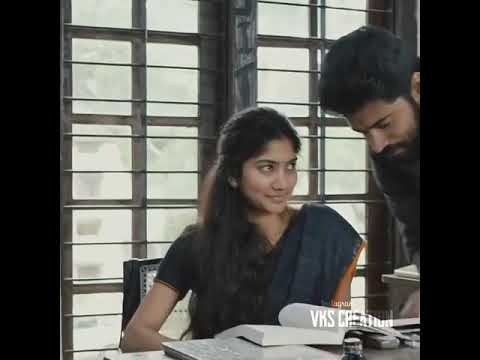
Locate an element on the screen. windows is located at coordinates (169, 127), (289, 84).